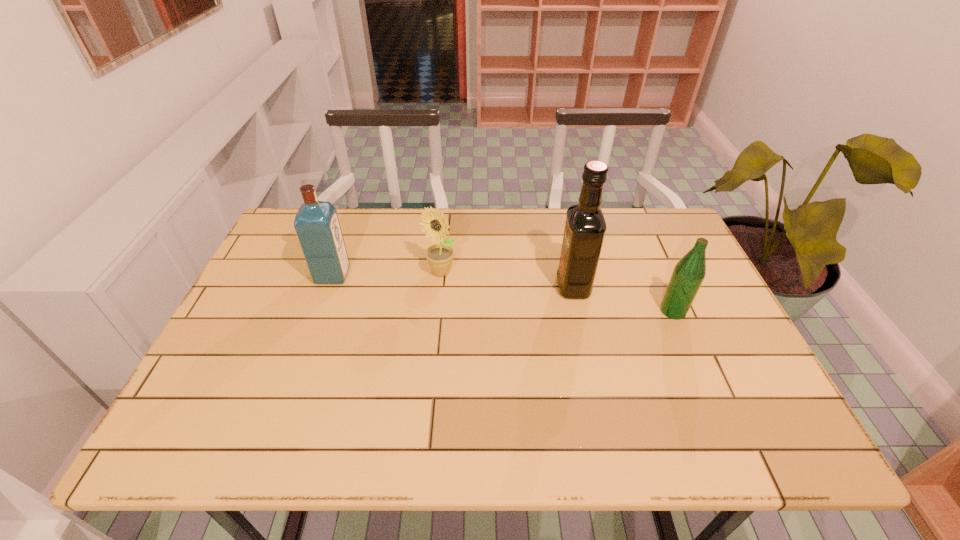
At what (x,y) coordinates should I click in order to perform the action: click on blank space located 0.100m on the left of the bottle. Please return your answer as a coordinate pair (x, y). The image size is (960, 540). Looking at the image, I should click on (621, 311).

The height and width of the screenshot is (540, 960). Find the location of `free space located 0.330m on the face of the sunflower`. free space located 0.330m on the face of the sunflower is located at coordinates (430, 384).

This screenshot has height=540, width=960. What are the coordinates of `object positioned at the right edge` in the screenshot? It's located at (688, 274).

Locate an element on the screen. This screenshot has height=540, width=960. blank area at the far edge is located at coordinates (421, 210).

I want to click on blank space at the near edge of the desktop, so click(553, 438).

In the image, there is a desktop. Where is `vacant region at the left edge`? vacant region at the left edge is located at coordinates (247, 384).

In order to click on vacant space at the right edge in this screenshot , I will do `click(719, 392)`.

You are a GUI agent. You are given a task and a screenshot of the screen. Output one action in this format:
    pyautogui.click(x=<x>, y=<y>)
    Task: Click on the vacant space at the near left corner of the desktop
    
    Given the screenshot: What is the action you would take?
    pyautogui.click(x=196, y=428)

In the image, there is a desktop. Where is `vacant region at the near right corner`? vacant region at the near right corner is located at coordinates (759, 428).

Locate an element on the screen. The height and width of the screenshot is (540, 960). free space between the rightmost object and the sunflower is located at coordinates (557, 292).